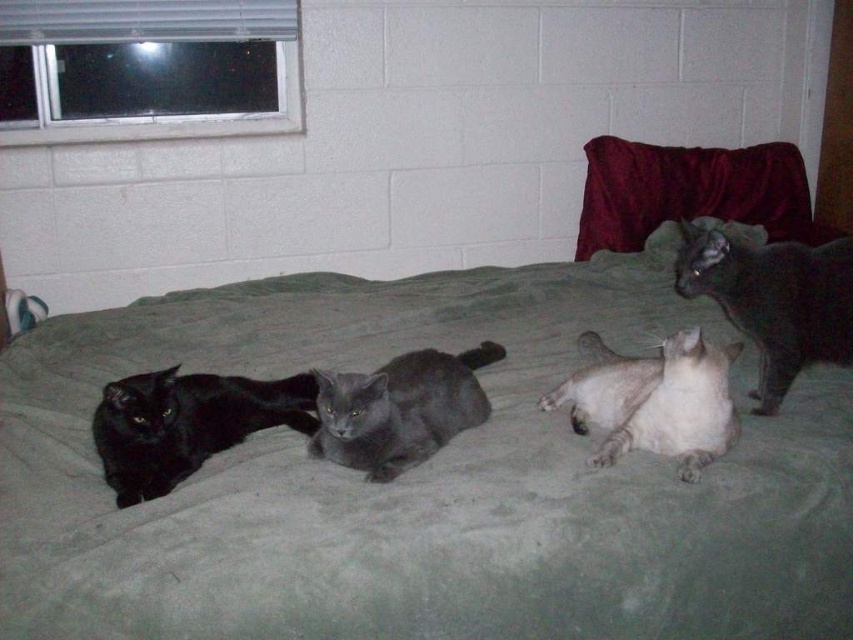
Between velvet-like dark red pillow at upper right and matte black cat at left, which one is positioned lower?

matte black cat at left is below.

Between velvet-like dark red pillow at upper right and matte black cat at left, which one appears on the right side from the viewer's perspective?

velvet-like dark red pillow at upper right is more to the right.

This screenshot has width=853, height=640. What are the coordinates of `velvet-like dark red pillow at upper right` in the screenshot? It's located at (689, 192).

This screenshot has height=640, width=853. Find the location of `velvet-like dark red pillow at upper right`. velvet-like dark red pillow at upper right is located at coordinates (689, 192).

In order to click on velvet-like dark red pillow at upper right in this screenshot , I will do `click(689, 192)`.

Does point (628, 246) come behind point (732, 356)?

That is True.

Who is more distant from viewer, (590, 225) or (541, 397)?

Positioned behind is point (590, 225).

Locate an element on the screen. velvet-like dark red pillow at upper right is located at coordinates (689, 192).

Is green fabric bedcover at center to the right of velvet-like dark red pillow at upper right from the viewer's perspective?

Incorrect, green fabric bedcover at center is not on the right side of velvet-like dark red pillow at upper right.

Can you confirm if green fabric bedcover at center is positioned to the left of velvet-like dark red pillow at upper right?

Yes, green fabric bedcover at center is to the left of velvet-like dark red pillow at upper right.

Is point (846, 560) positioned before point (717, 214)?

Yes.

This screenshot has width=853, height=640. What are the coordinates of `green fabric bedcover at center` in the screenshot? It's located at (421, 480).